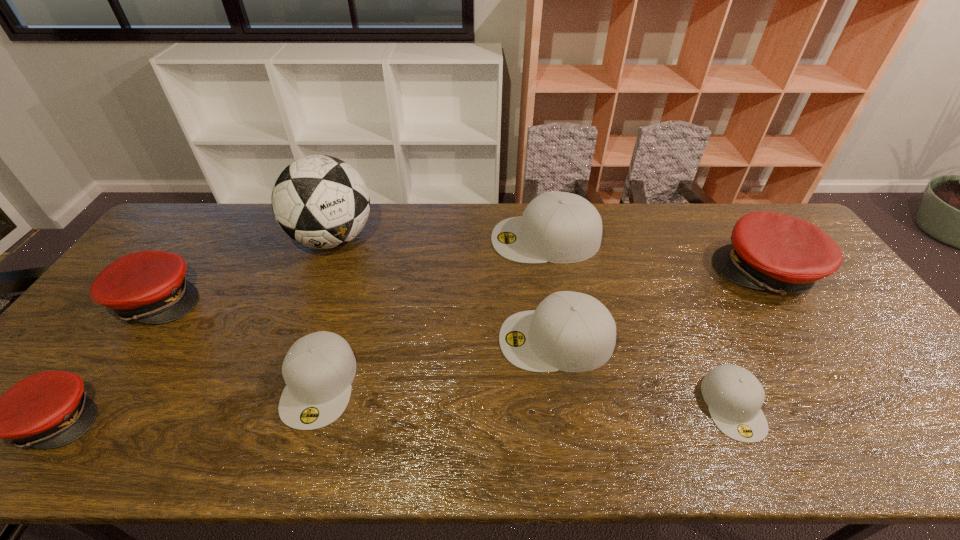
This screenshot has width=960, height=540. I want to click on vacant space at the far left corner of the desktop, so click(210, 218).

The image size is (960, 540). In the image, there is a desktop. In order to click on vacant space at the near right corner in this screenshot , I will do `click(899, 445)`.

Locate an element on the screen. The image size is (960, 540). blank region between the second smallest red cap and the biggest red cap is located at coordinates (462, 286).

At what (x,y) coordinates should I click in order to perform the action: click on free spot between the second object from right to left and the fifth cap from right to left. Please return your answer as a coordinate pair (x, y). The width and height of the screenshot is (960, 540). Looking at the image, I should click on (526, 395).

Locate an element on the screen. Image resolution: width=960 pixels, height=540 pixels. free area in between the biggest gray cap and the fifth cap from right to left is located at coordinates (433, 312).

At what (x,y) coordinates should I click in order to perform the action: click on free space between the soccer ball and the second biggest gray cap. Please return your answer as a coordinate pair (x, y). The width and height of the screenshot is (960, 540). Looking at the image, I should click on (444, 289).

Locate an element on the screen. Image resolution: width=960 pixels, height=540 pixels. vacant area that lies between the seventh object from left to right and the second smallest gray cap is located at coordinates (526, 395).

Identify the location of vacant point located between the biggest gray cap and the rightmost gray cap. This screenshot has height=540, width=960. (639, 322).

Locate which object is the seventh closest to the nearest red cap. Please provide its 2D coordinates. Your answer should be formatted as a tuple, i.e. [(x, y)], where the tuple contains the x and y coordinates of a point satisfying the conditions above.

[(770, 251)]

This screenshot has width=960, height=540. Find the location of `object that is the second closest to the second smallest red cap`. object that is the second closest to the second smallest red cap is located at coordinates (50, 409).